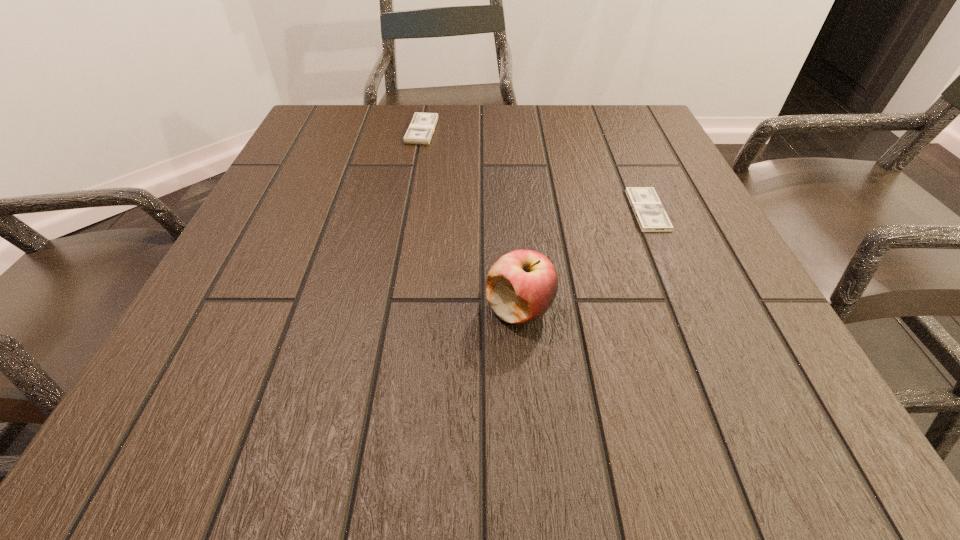
Where is `free space between the nearest object and the second tallest object`? The width and height of the screenshot is (960, 540). free space between the nearest object and the second tallest object is located at coordinates (471, 220).

Find the location of `free space that is in between the shortest object and the apple`. free space that is in between the shortest object and the apple is located at coordinates (584, 260).

The image size is (960, 540). In order to click on free space between the leftmost object and the nearest object in this screenshot , I will do `click(471, 220)`.

Where is `free space that is in between the farthest object and the nearer dollar`? The width and height of the screenshot is (960, 540). free space that is in between the farthest object and the nearer dollar is located at coordinates (535, 171).

Where is `vacant point located between the taller dollar and the nearer dollar`? The height and width of the screenshot is (540, 960). vacant point located between the taller dollar and the nearer dollar is located at coordinates (535, 171).

Locate an element on the screen. This screenshot has width=960, height=540. vacant region between the leftmost object and the nearest object is located at coordinates (471, 220).

Find the location of `vacant point located between the second object from left to right and the taller dollar`. vacant point located between the second object from left to right and the taller dollar is located at coordinates (471, 220).

The height and width of the screenshot is (540, 960). Find the location of `the closest object to the second object from left to right`. the closest object to the second object from left to right is located at coordinates (648, 209).

At what (x,y) coordinates should I click in order to perform the action: click on object that stands as the second closest to the second tallest object. Please return your answer as a coordinate pair (x, y). The width and height of the screenshot is (960, 540). Looking at the image, I should click on tap(521, 286).

This screenshot has width=960, height=540. Identify the location of free spot that satisfies the following two spatial constraints: 1. on the back side of the rightmost object; 2. on the right side of the apple. (512, 210).